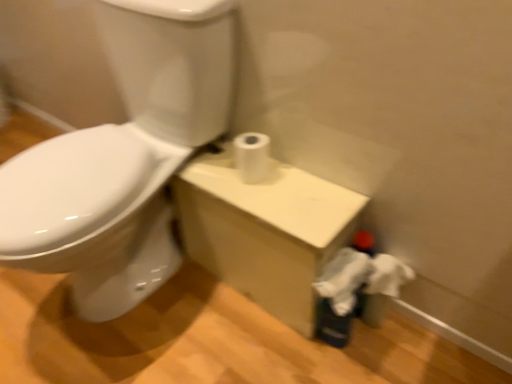
You are a GUI agent. You are given a task and a screenshot of the screen. Output one action in this format:
    pyautogui.click(x=<x>, y=<y>)
    Task: Click on the vacant space to the right of white matte toilet paper at center
    
    Given the screenshot: What is the action you would take?
    pyautogui.click(x=306, y=178)